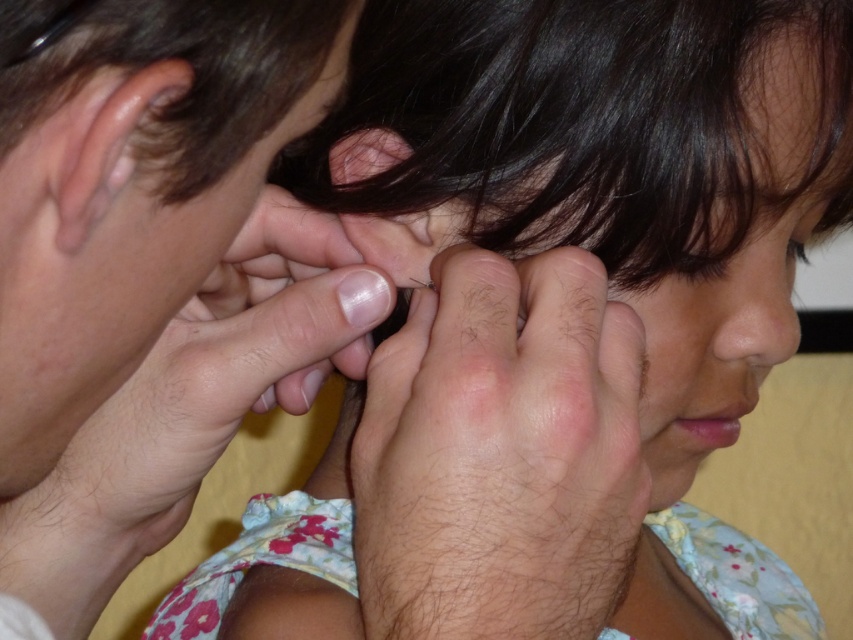
Question: Based on their relative distances, which object is farther from the matte black ear at upper center?

Choices:
 (A) hair at center
 (B) smooth skin nose at center
 (C) smooth skin face at upper left

Answer: (B)

Question: Can you confirm if smooth skin hand at upper left is positioned above smooth skin nose at center?

Choices:
 (A) no
 (B) yes

Answer: (A)

Question: In this image, where is smooth skin nose at center located relative to matte black ear at upper center?

Choices:
 (A) below
 (B) above

Answer: (A)

Question: Considering the real-world distances, which object is closest to the smooth skin hand at upper left?

Choices:
 (A) smooth skin face at upper left
 (B) pink flesh-colored ear at upper left
 (C) smooth skin nose at center
 (D) hair at center

Answer: (D)

Question: Which point is farther to the camera?

Choices:
 (A) smooth skin nose at center
 (B) smooth skin face at upper left

Answer: (A)

Question: Is smooth skin hand at upper left positioned in front of matte black ear at upper center?

Choices:
 (A) no
 (B) yes

Answer: (B)